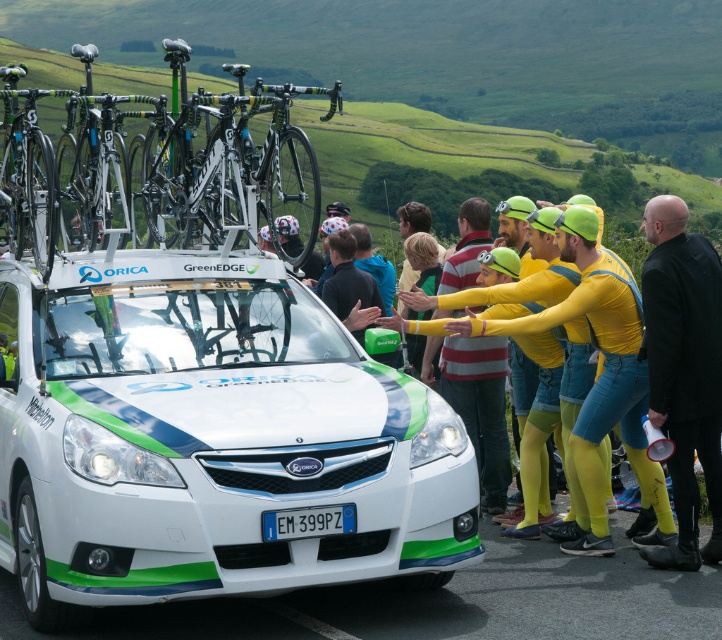
Is shiny black bike at upper left closer to camera compared to shiny black bike at left?

Yes, shiny black bike at upper left is closer to the viewer.

Which is behind, point (110, 172) or point (17, 177)?

The point (17, 177) is behind.

Who is more forward, (123, 163) or (45, 212)?

Point (45, 212)

Find the location of a particular element. This screenshot has width=722, height=640. shiny black bike at upper left is located at coordinates 156,168.

Is point (700, 406) positioned in front of point (516, 276)?

Yes, point (700, 406) is in front of point (516, 276).

Does point (682, 493) come behind point (508, 252)?

No, (682, 493) is in front of (508, 252).

The height and width of the screenshot is (640, 722). What are the coordinates of `black leather jacket at right` in the screenshot? It's located at point(682,371).

How far apart are yellow spandex at center and shiny black bike at left?

A distance of 12.00 feet exists between yellow spandex at center and shiny black bike at left.

Does point (434, 339) lie in front of point (69, 90)?

Yes, it is.

This screenshot has width=722, height=640. What are the coordinates of `yellow spandex at center` in the screenshot? It's located at coord(479,408).